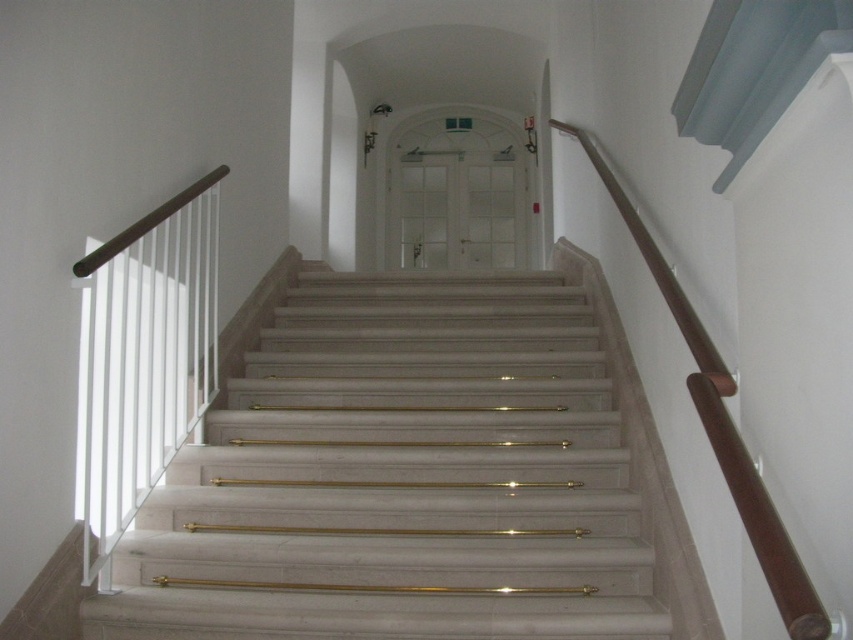
You are standing at the bottom of the staircase in the image. You see two points marked on the wall. The first point is at coordinates point (x=564, y=547) and the second is at point (x=746, y=529). If you were to walk straight up the staircase towards the door, which point would you encounter first?

Point (x=746, y=529) would be encountered first because it is in front of point (x=564, y=547) according to their positions.

You are standing at the bottom of the staircase and want to grab the brown polished wood handrail at upper right. Which direction should you move relative to the white marble stairs at center to reach it?

To reach the brown polished wood handrail at upper right, you should move to the right side of the white marble stairs at center since it is positioned on the left side of the handrail.

You are a delivery person carrying a large package that is 1.5 meters wide. You need to navigate through the hallway shown in the image. Can you pass through the area between the white marble stairs at center and the brown polished wood handrail at upper right?

The white marble stairs at center might be wider than brown polished wood handrail at upper right, so it is uncertain if the 1.5 meter wide package can pass through the space between them. Check the actual width before proceeding.